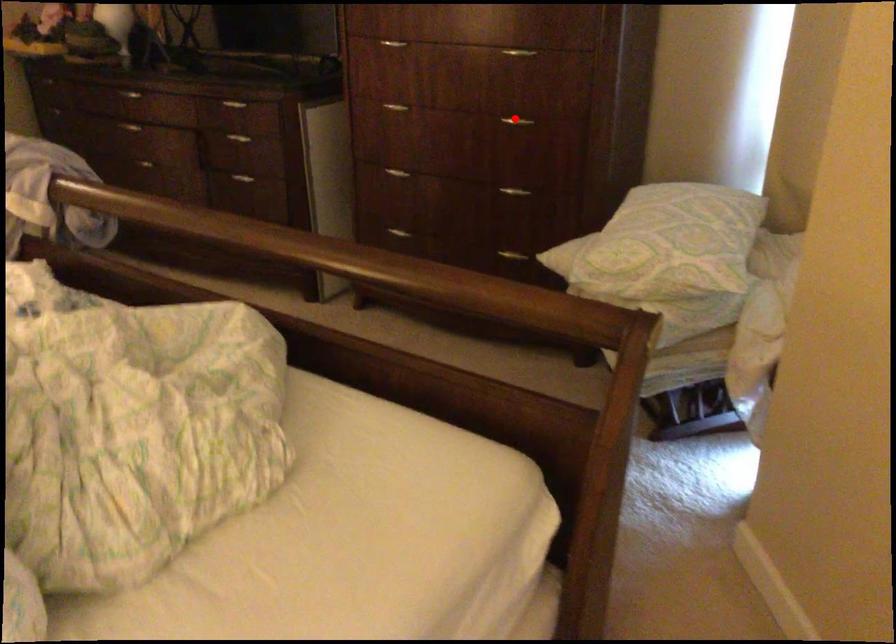
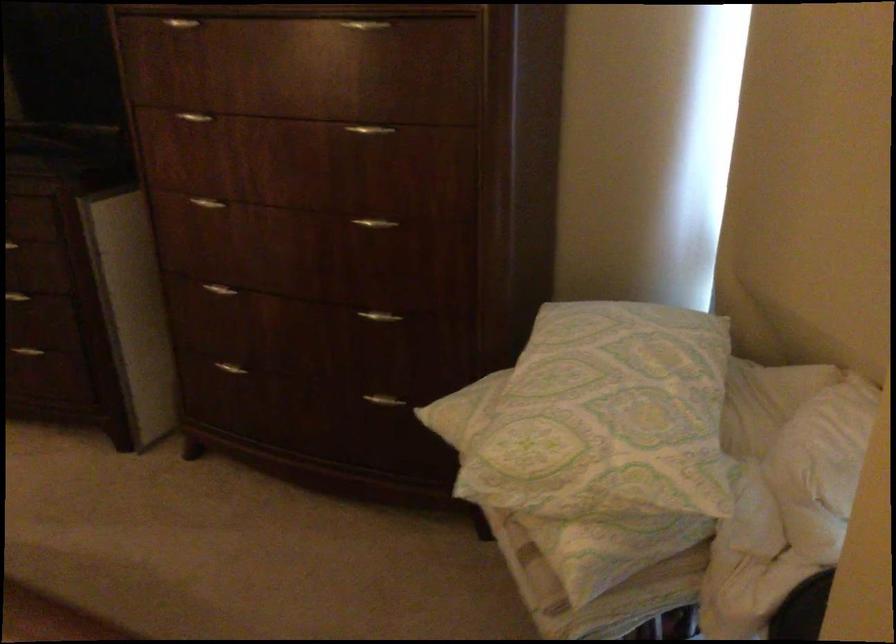
Find the pixel in the second image that matches the highlighted location in the first image.

(375, 223)